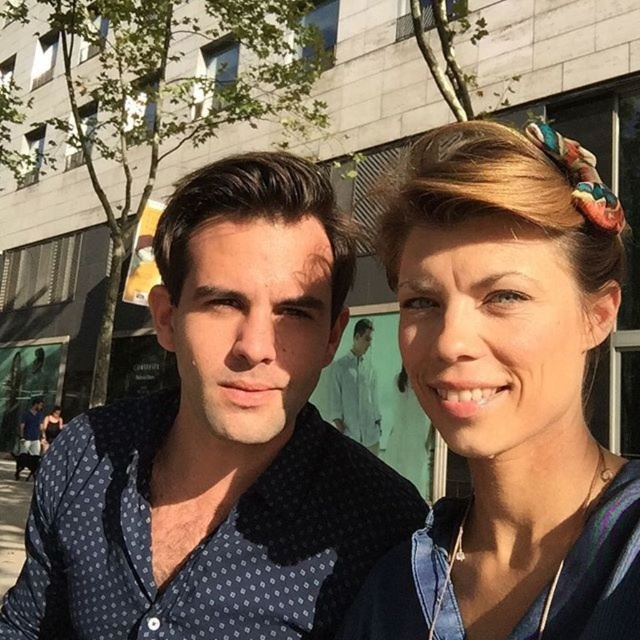
You are a tailor measuring accessories and clothing for a client. You have a blue fabric headband at upper right and a white smooth shirt at center. Which item has a smaller width?

The blue fabric headband at upper right has a smaller width than the white smooth shirt at center.

You are a photographer standing at a distance of 40 inches from the two people in the image. You want to take a clear photo of the blue dotted shirt at center without moving closer. Is the current distance sufficient?

The blue dotted shirt at center is 38.44 inches away from viewer, so the photographer is 1.56 inches too far to capture the blue dotted shirt at center clearly without moving closer.

You are taking a photo of two people standing in an urban setting. You want to focus on the person closer to the camera. Which point should you focus on, point 1 at [131,522] or point 2 at [513,547]?

Point 1 at [131,522] is further to the camera than point 2 at [513,547], so you should focus on point 1 at [131,522] to capture the person closer to the camera.